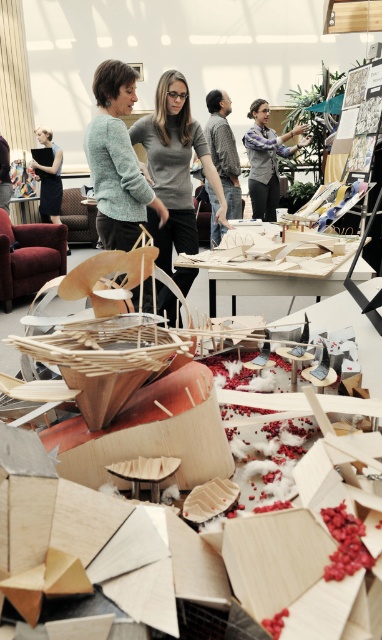
Question: Is matte gray sweater at center above knitted teal sweater at center?

Choices:
 (A) yes
 (B) no

Answer: (A)

Question: Which point is farther from the camera taking this photo?

Choices:
 (A) (262, 131)
 (B) (56, 173)
 (C) (203, 138)
 (D) (118, 97)

Answer: (B)

Question: Does matte gray sweater at center come in front of matte black dress at left?

Choices:
 (A) yes
 (B) no

Answer: (A)

Question: Which of these objects is positioned farthest from the matte gray sweater at center?

Choices:
 (A) matte black dress at left
 (B) plaid shirt at upper center

Answer: (A)

Question: Which point is farther to the camera?

Choices:
 (A) plaid shirt at upper center
 (B) matte gray sweater at center
 (C) matte black dress at left

Answer: (C)

Question: Does matte gray sweater at center have a larger size compared to knitted teal sweater at center?

Choices:
 (A) no
 (B) yes

Answer: (B)